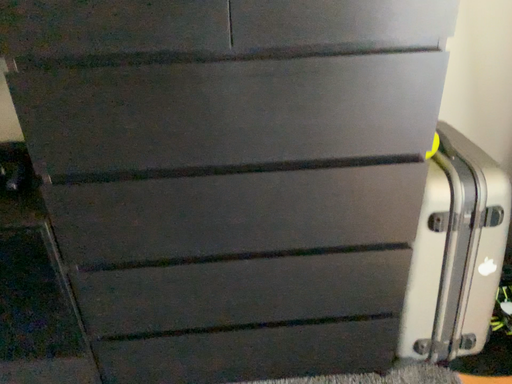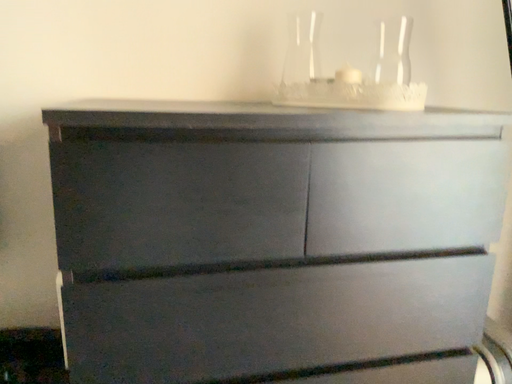
Question: How did the camera likely rotate when shooting the video?

Choices:
 (A) rotated downward
 (B) rotated upward

Answer: (B)